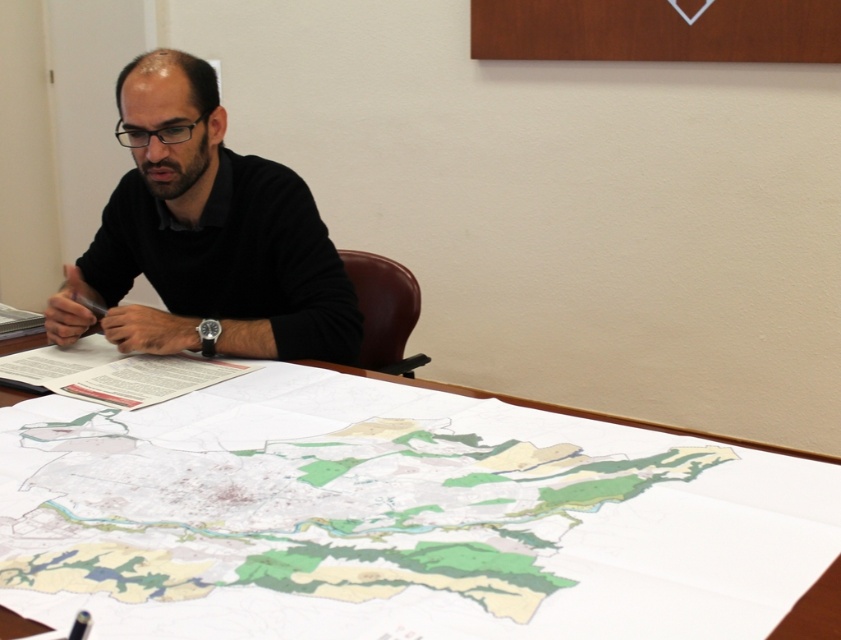
Does white paper map at center appear on the right side of black matte shirt at upper left?

Yes, white paper map at center is to the right of black matte shirt at upper left.

Is white paper map at center to the left of black matte shirt at upper left from the viewer's perspective?

No, white paper map at center is not to the left of black matte shirt at upper left.

Who is more forward, (837, 524) or (184, 202)?

Positioned in front is point (837, 524).

I want to click on white paper map at center, so click(x=395, y=518).